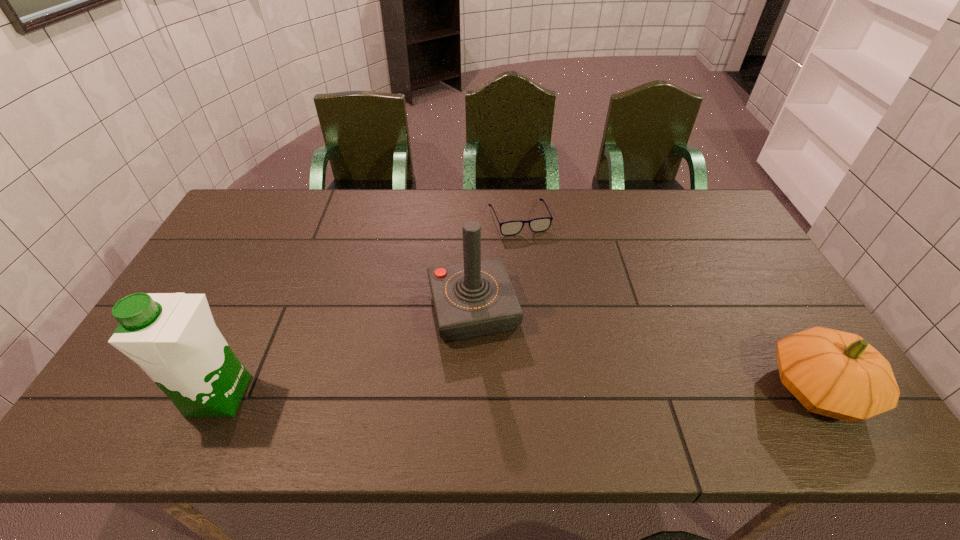
Image resolution: width=960 pixels, height=540 pixels. Identify the location of vacant space on the desktop that is between the leftmost object and the third tallest object and is positioned on the front-facing side of the spectacles. (590, 392).

You are a GUI agent. You are given a task and a screenshot of the screen. Output one action in this format:
    pyautogui.click(x=<x>, y=<y>)
    Task: Click on the free space on the desktop that is between the leftmost object and the gourd and is positioned on the rectangular base of the third nearest object
    This screenshot has height=540, width=960.
    Given the screenshot: What is the action you would take?
    click(497, 393)